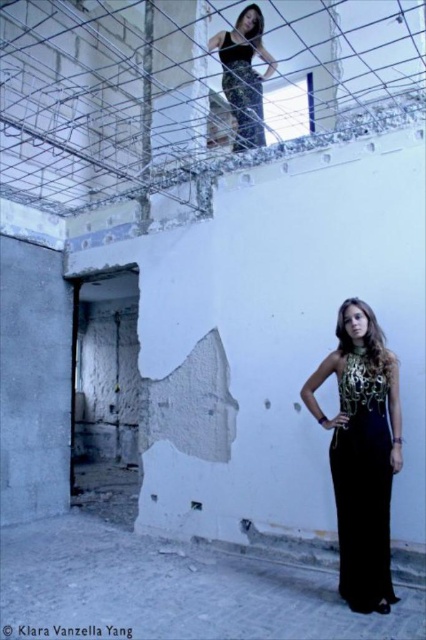
Based on the photo, which is more to the right, metallic wire mesh at upper center or black satin dress at lower center?

Positioned to the right is black satin dress at lower center.

The height and width of the screenshot is (640, 426). I want to click on metallic wire mesh at upper center, so (x=190, y=90).

Image resolution: width=426 pixels, height=640 pixels. Describe the element at coordinates (190, 90) in the screenshot. I see `metallic wire mesh at upper center` at that location.

Identify the location of metallic wire mesh at upper center. Image resolution: width=426 pixels, height=640 pixels. (x=190, y=90).

Which of these two, black satin dress at lower center or shiny black dress at upper center, stands shorter?

Standing shorter between the two is black satin dress at lower center.

This screenshot has height=640, width=426. Describe the element at coordinates (362, 483) in the screenshot. I see `black satin dress at lower center` at that location.

Locate an element on the screen. This screenshot has width=426, height=640. black satin dress at lower center is located at coordinates (362, 483).

Does metallic wire mesh at upper center appear on the left side of shiny black dress at upper center?

Yes, metallic wire mesh at upper center is to the left of shiny black dress at upper center.

Does metallic wire mesh at upper center appear on the right side of shiny black dress at upper center?

No, metallic wire mesh at upper center is not to the right of shiny black dress at upper center.

Between point (420, 84) and point (250, 88), which one is positioned behind?

Positioned behind is point (250, 88).

I want to click on metallic wire mesh at upper center, so click(190, 90).